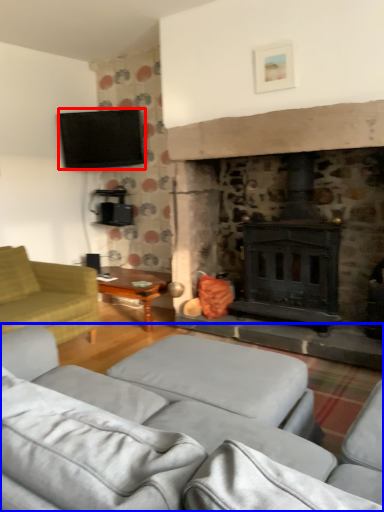
Question: Which of the following is the closest to the observer, television (highlighted by a red box) or studio couch (highlighted by a blue box)?

Choices:
 (A) television
 (B) studio couch

Answer: (B)